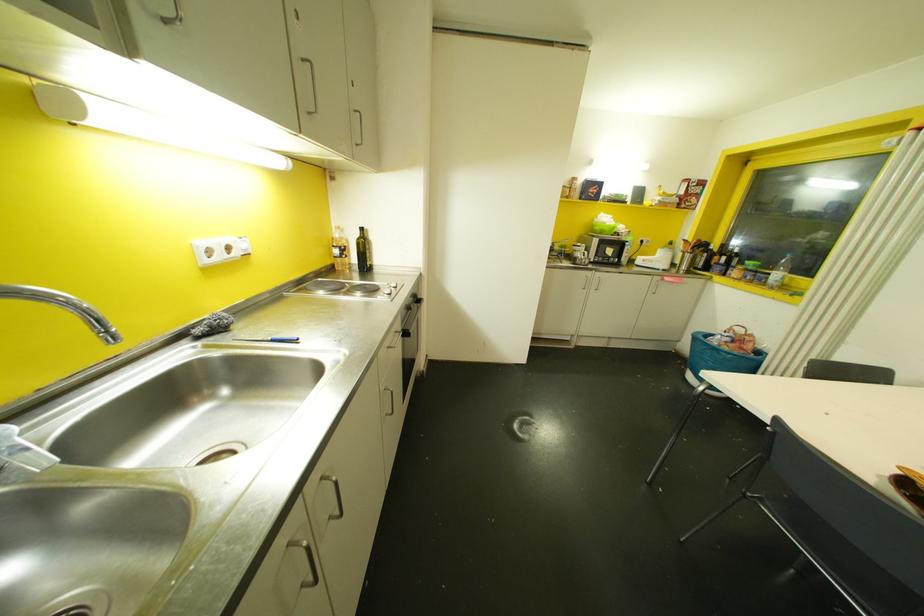
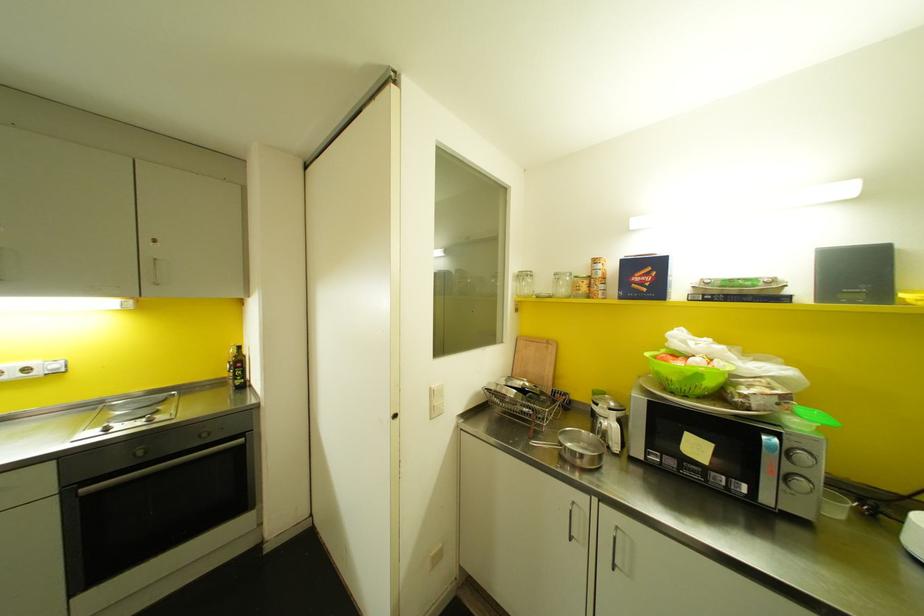
The point at [566,197] is marked in the first image. Where is the corresponding point in the second image?

(588, 294)